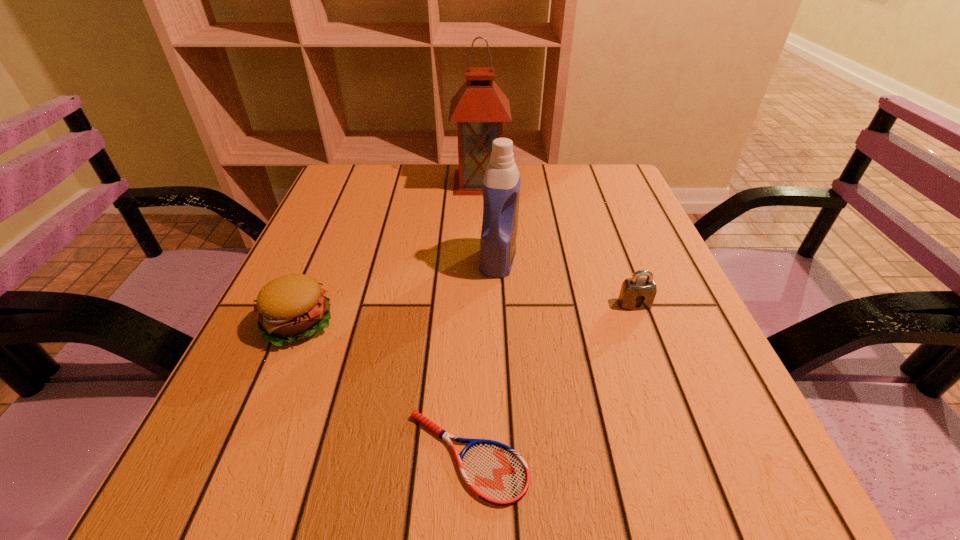
At what (x,y) coordinates should I click in order to perform the action: click on free space that is in between the rightmost object and the leftmost object. Please return your answer as a coordinate pair (x, y). Looking at the image, I should click on (466, 314).

Find the location of a particular element. This screenshot has width=960, height=540. free space between the leftmost object and the fourth nearest object is located at coordinates (397, 292).

I want to click on vacant point located between the padlock and the tallest object, so click(557, 243).

Locate which object is the fourth closest to the tallest object. Please provide its 2D coordinates. Your answer should be formatted as a tuple, i.e. [(x, y)], where the tuple contains the x and y coordinates of a point satisfying the conditions above.

[(496, 473)]

Identify the location of the closest object to the rightmost object. (501, 185).

I want to click on free space that satisfies the following two spatial constraints: 1. on the front side of the lantern; 2. on the left side of the fourth nearest object, so click(480, 259).